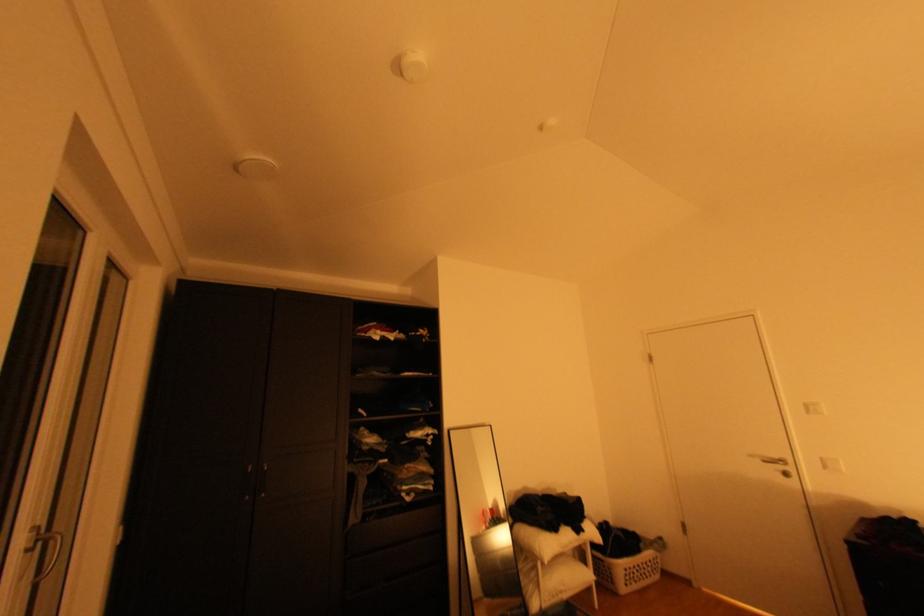
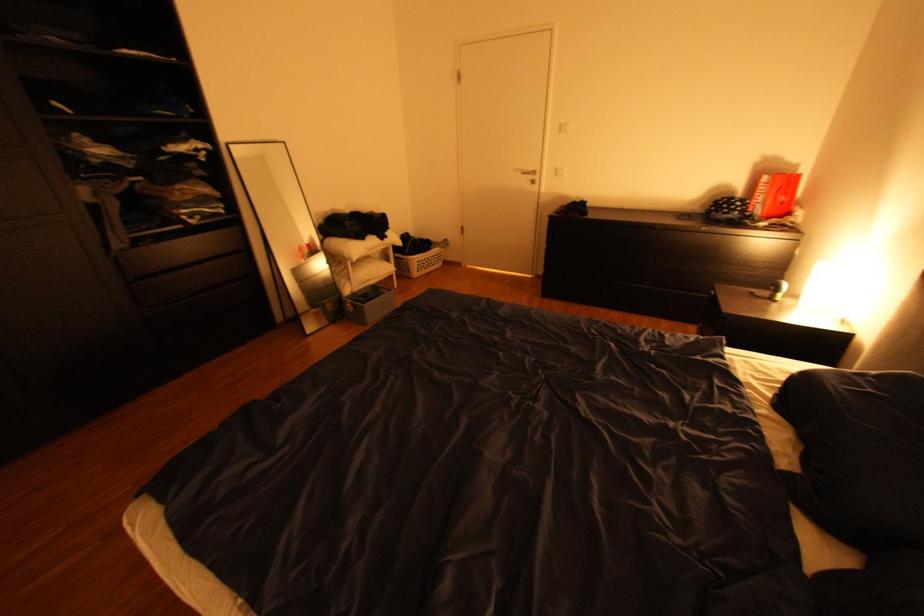
Locate, in the second image, the point that corresponds to the point at 762,456 in the first image.

(526, 171)